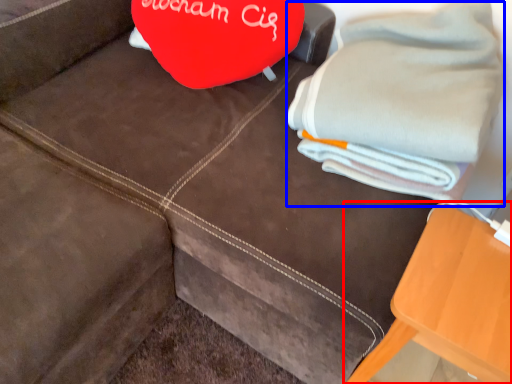
Question: Among these objects, which one is farthest to the camera, furniture (highlighted by a red box) or bath towel (highlighted by a blue box)?

Choices:
 (A) furniture
 (B) bath towel

Answer: (B)